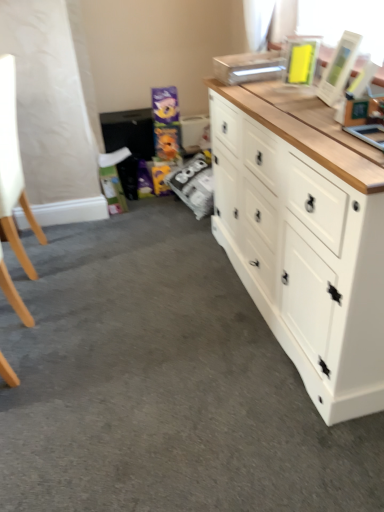
At what (x,y) coordinates should I click in order to perform the action: click on free space above white wood chest of drawers at right (from a real-world perspective). Please return your answer as a coordinate pair (x, y). Looking at the image, I should click on (299, 103).